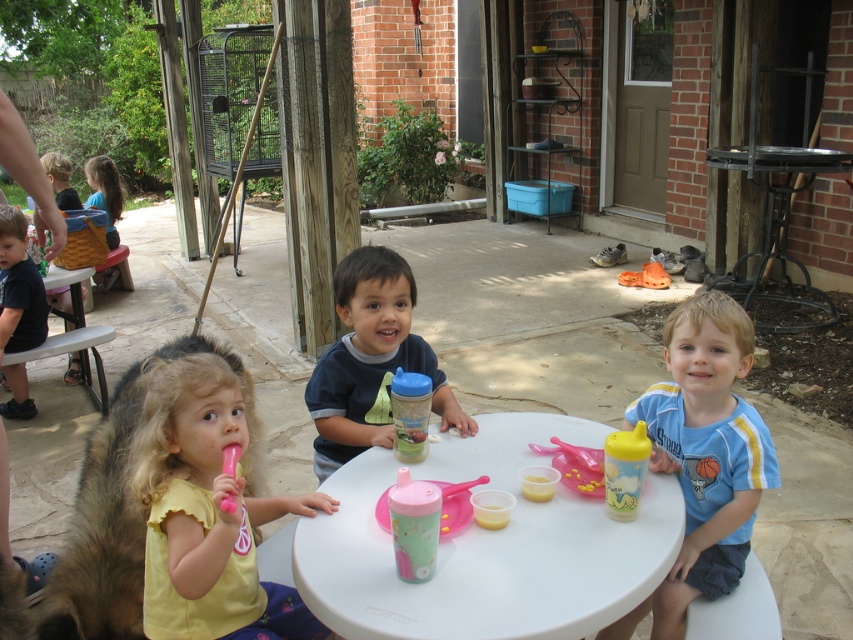
In the scene shown: Between blue matte shirt at center and black metal picnic table at right, which one has less height?

Standing shorter between the two is blue matte shirt at center.

I want to click on blue matte shirt at center, so click(370, 360).

Find the location of a particular element. The width and height of the screenshot is (853, 640). blue matte shirt at center is located at coordinates [x=370, y=360].

What do you see at coordinates (370, 360) in the screenshot? Image resolution: width=853 pixels, height=640 pixels. I see `blue matte shirt at center` at bounding box center [370, 360].

Between blue matte shirt at center and blonde hair at left, which one appears on the right side from the viewer's perspective?

From the viewer's perspective, blue matte shirt at center appears more on the right side.

Who is more distant from viewer, (339,378) or (122,198)?

The point (122,198) is behind.

Find the location of a particular element. The image size is (853, 640). blue matte shirt at center is located at coordinates (370, 360).

Does point (726, 344) lie in front of point (550, 474)?

No, (726, 344) is further to viewer.

In the scene shown: Which is more to the left, yellow rubber sippy cup at center or yellow plastic cup at center?

Positioned to the left is yellow plastic cup at center.

Is point (746, 538) in front of point (527, 484)?

No.

Where is `yellow rubber sippy cup at center`? Image resolution: width=853 pixels, height=640 pixels. yellow rubber sippy cup at center is located at coordinates (703, 456).